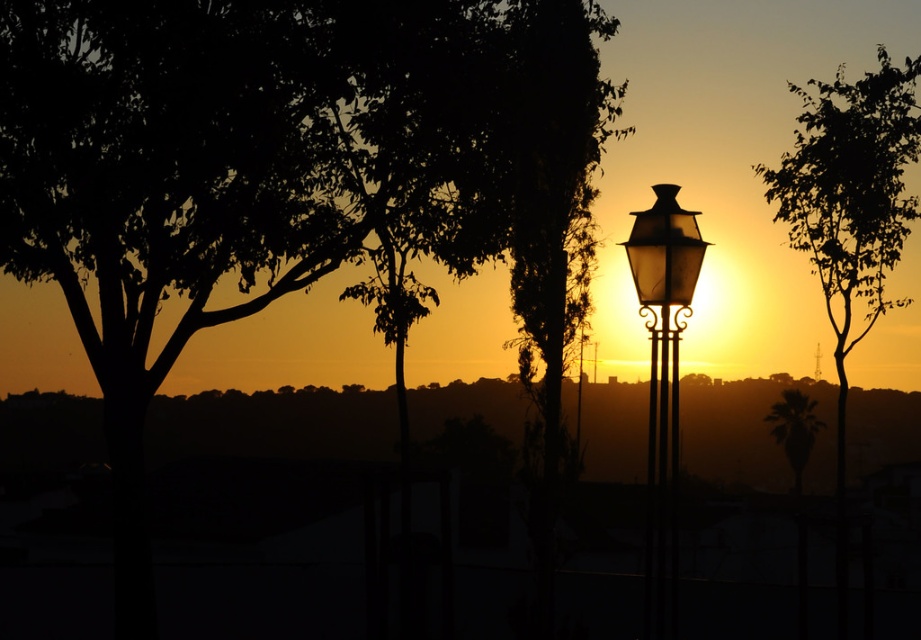
In the scene shown: You are standing at the point with coordinates point (x=774, y=420) and want to walk towards the point with coordinates point (x=637, y=234). Given the scene described, which direction should you face to move directly towards your destination?

You should face towards the point (x=637, y=234) because it is in front of point (x=774, y=420), meaning it is closer to your current position.

You are a photographer trying to capture the sunset. You notice the translucent glass street light at center and the silhouette palm tree at center in your shot. Which object appears taller in the photo?

The silhouette palm tree at center appears taller than the translucent glass street light at center in the photo.

You are standing in the middle of a path that leads to the sunset scene. You see the metallic lantern at center and the silhouette palm tree at center. Which object is positioned to the left when facing the sunset?

The metallic lantern at center is to the left of the silhouette palm tree at center when facing the sunset.